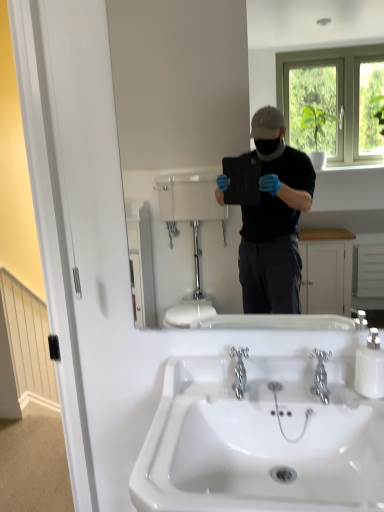
Question: Is polished chrome faucet at center, which is counted as the 2th plumbing fixture, starting from the left, turned away from matte black tablet at center?

Choices:
 (A) yes
 (B) no

Answer: (B)

Question: From the image's perspective, does polished chrome faucet at center, which ranks as the 1th plumbing fixture in right-to-left order, appear lower than matte black tablet at center?

Choices:
 (A) yes
 (B) no

Answer: (A)

Question: From the image's perspective, would you say polished chrome faucet at center, which is counted as the 2th plumbing fixture, starting from the left, is positioned over matte black tablet at center?

Choices:
 (A) yes
 (B) no

Answer: (B)

Question: Can you confirm if polished chrome faucet at center, which is counted as the 2th plumbing fixture, starting from the left, is bigger than matte black tablet at center?

Choices:
 (A) yes
 (B) no

Answer: (B)

Question: Can you confirm if polished chrome faucet at center, which is counted as the 2th plumbing fixture, starting from the left, is smaller than matte black tablet at center?

Choices:
 (A) yes
 (B) no

Answer: (A)

Question: Does polished chrome faucet at center, which is counted as the 2th plumbing fixture, starting from the left, turn towards matte black tablet at center?

Choices:
 (A) yes
 (B) no

Answer: (B)

Question: Considering the relative sizes of polished chrome faucet at center, which ranks as the 1th plumbing fixture in right-to-left order, and white glossy soap dispenser at right in the image provided, is polished chrome faucet at center, which ranks as the 1th plumbing fixture in right-to-left order, thinner than white glossy soap dispenser at right?

Choices:
 (A) yes
 (B) no

Answer: (B)

Question: Can you confirm if polished chrome faucet at center, which is counted as the 2th plumbing fixture, starting from the left, is smaller than white glossy soap dispenser at right?

Choices:
 (A) no
 (B) yes

Answer: (B)

Question: Is polished chrome faucet at center, which is counted as the 2th plumbing fixture, starting from the left, shorter than white glossy soap dispenser at right?

Choices:
 (A) no
 (B) yes

Answer: (B)

Question: From a real-world perspective, is polished chrome faucet at center, which is counted as the 2th plumbing fixture, starting from the left, located beneath white glossy soap dispenser at right?

Choices:
 (A) yes
 (B) no

Answer: (A)

Question: From the image's perspective, is polished chrome faucet at center, which ranks as the 1th plumbing fixture in right-to-left order, above white glossy soap dispenser at right?

Choices:
 (A) yes
 (B) no

Answer: (B)

Question: Is polished chrome faucet at center, which ranks as the 1th plumbing fixture in right-to-left order, positioned in front of white glossy soap dispenser at right?

Choices:
 (A) no
 (B) yes

Answer: (B)

Question: From the image's perspective, is white glossy sink at center located beneath matte black tablet at center?

Choices:
 (A) yes
 (B) no

Answer: (A)